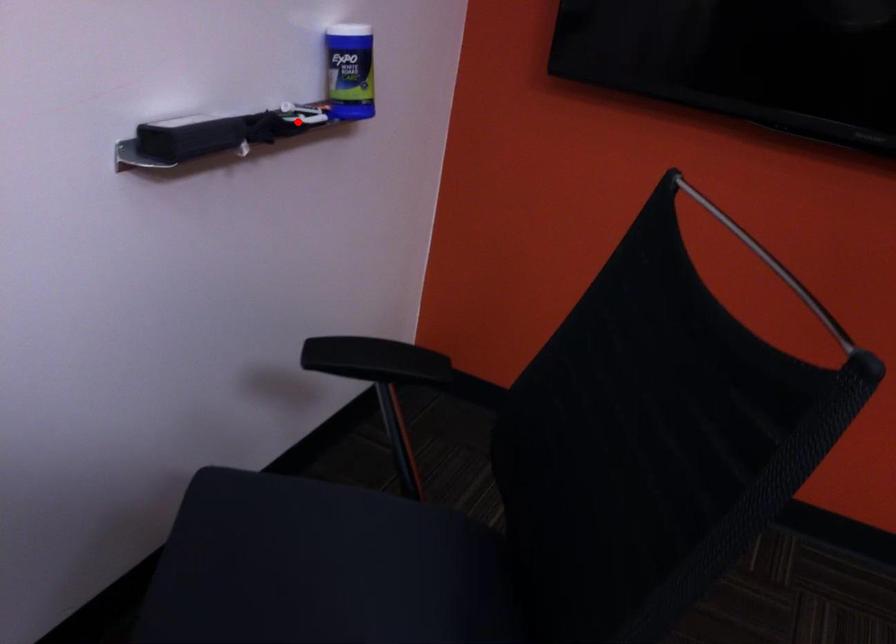
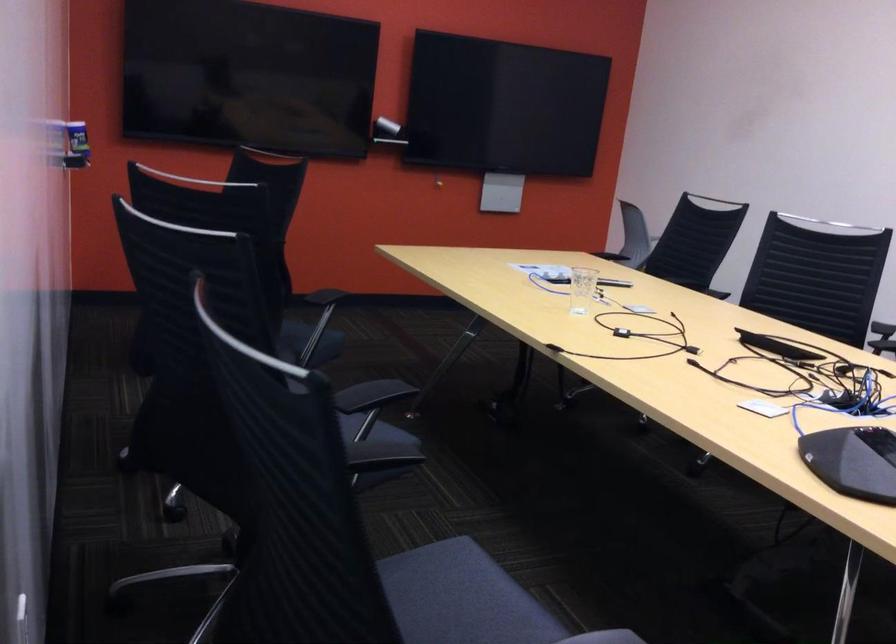
Question: I am providing you with two images of the same scene from different viewpoints. Image1 has a red point marked. In image2, the corresponding 3D location appears at what relative position? Reply with the corresponding letter.

Choices:
 (A) Closer
 (B) Farther

Answer: (B)